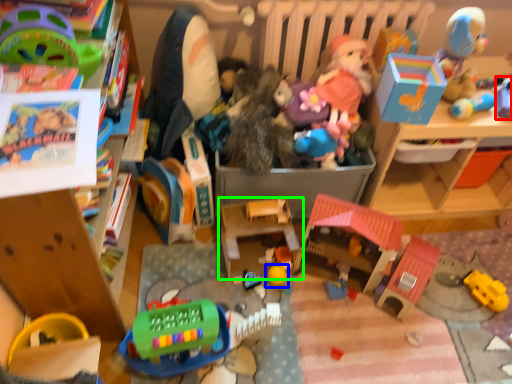
Question: Estimate the real-world distances between objects in this image. Which object is farther from toy (highlighted by a red box), toy (highlighted by a blue box) or toy (highlighted by a green box)?

Choices:
 (A) toy
 (B) toy

Answer: (A)